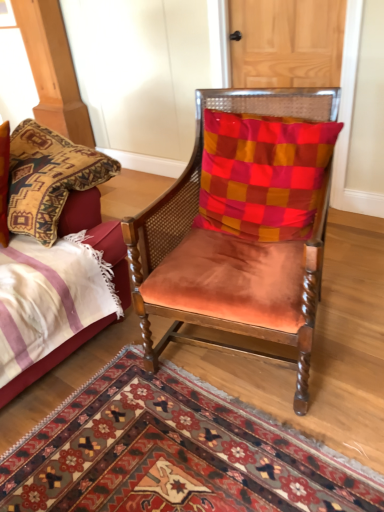
Question: Is checkered fabric pillow at center with suede orange chair at center?

Choices:
 (A) yes
 (B) no

Answer: (B)

Question: Is checkered fabric pillow at center aimed at suede orange chair at center?

Choices:
 (A) yes
 (B) no

Answer: (A)

Question: Is checkered fabric pillow at center outside suede orange chair at center?

Choices:
 (A) yes
 (B) no

Answer: (B)

Question: Can you confirm if checkered fabric pillow at center is taller than suede orange chair at center?

Choices:
 (A) yes
 (B) no

Answer: (B)

Question: Considering the relative positions of checkered fabric pillow at center and suede orange chair at center in the image provided, is checkered fabric pillow at center to the left of suede orange chair at center from the viewer's perspective?

Choices:
 (A) no
 (B) yes

Answer: (A)

Question: Can you confirm if checkered fabric pillow at center is shorter than suede orange chair at center?

Choices:
 (A) yes
 (B) no

Answer: (A)

Question: Is velvet bed at left outside of suede orange chair at center?

Choices:
 (A) yes
 (B) no

Answer: (A)

Question: Is velvet bed at left next to suede orange chair at center?

Choices:
 (A) yes
 (B) no

Answer: (B)

Question: From the image's perspective, is velvet bed at left on top of suede orange chair at center?

Choices:
 (A) no
 (B) yes

Answer: (A)

Question: Considering the relative sizes of velvet bed at left and suede orange chair at center in the image provided, is velvet bed at left thinner than suede orange chair at center?

Choices:
 (A) yes
 (B) no

Answer: (B)

Question: From a real-world perspective, is velvet bed at left under suede orange chair at center?

Choices:
 (A) yes
 (B) no

Answer: (A)

Question: Is suede orange chair at center inside velvet bed at left?

Choices:
 (A) no
 (B) yes

Answer: (A)

Question: Does suede orange chair at center have a lesser height compared to carpet with intricate patterns at center?

Choices:
 (A) yes
 (B) no

Answer: (B)